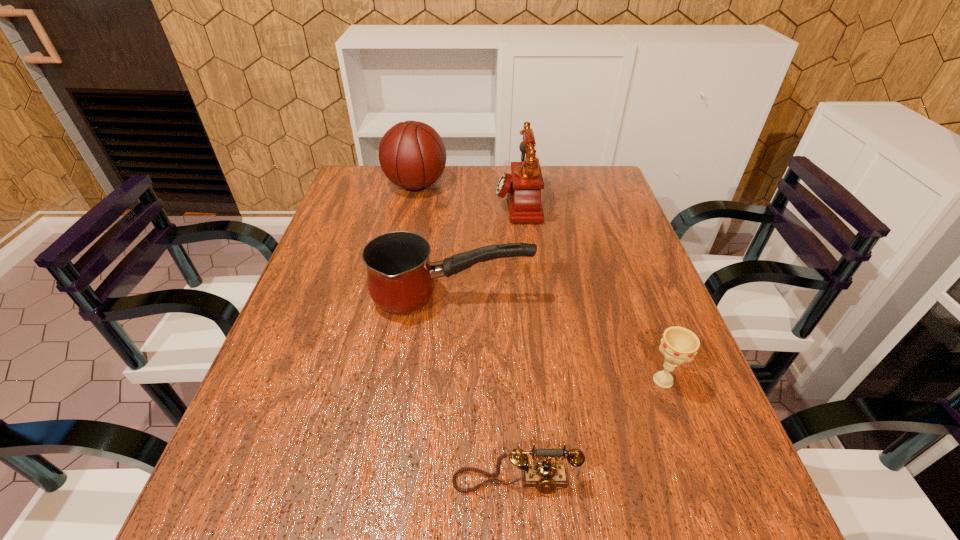
Where is `vacant space that satisfies the following two spatial constraints: 1. on the dial of the taller telephone; 2. on the front-facing side of the nearer telephone`? vacant space that satisfies the following two spatial constraints: 1. on the dial of the taller telephone; 2. on the front-facing side of the nearer telephone is located at coordinates (550, 482).